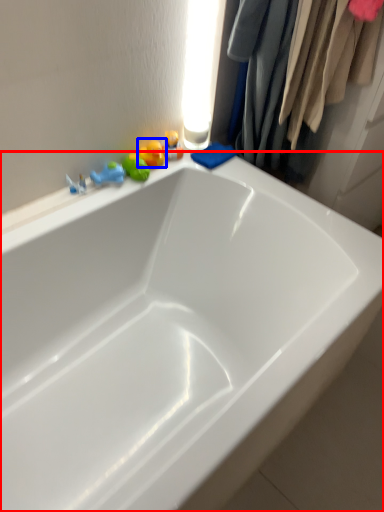
Question: Which of the following is the farthest to the observer, bathtub (highlighted by a red box) or toy (highlighted by a blue box)?

Choices:
 (A) bathtub
 (B) toy

Answer: (B)